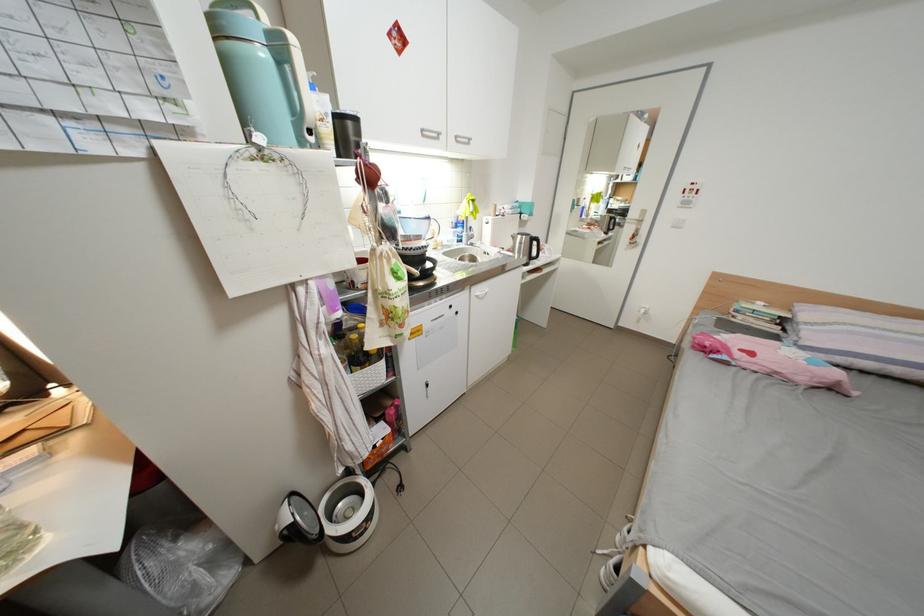
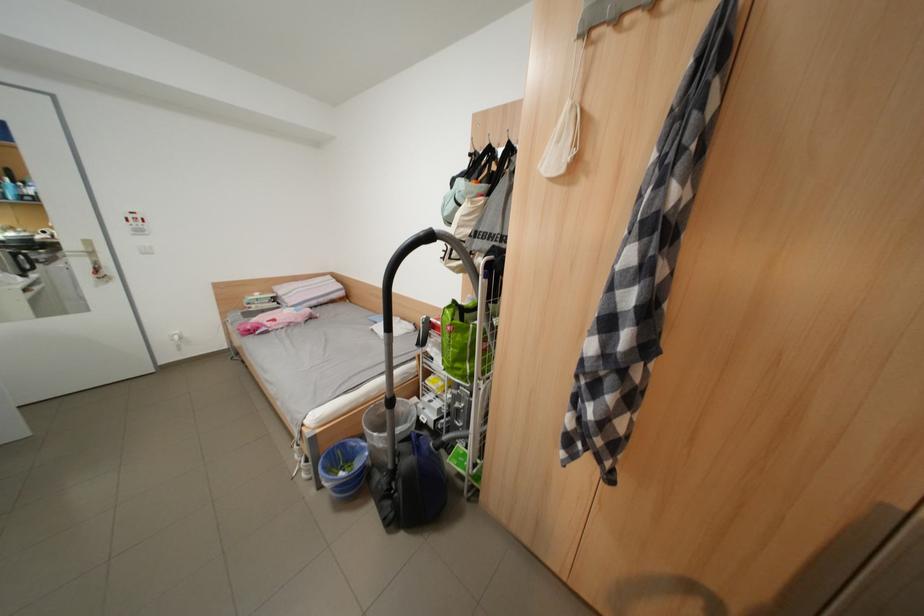
The point at (816, 334) is marked in the first image. Where is the corresponding point in the second image?

(298, 302)